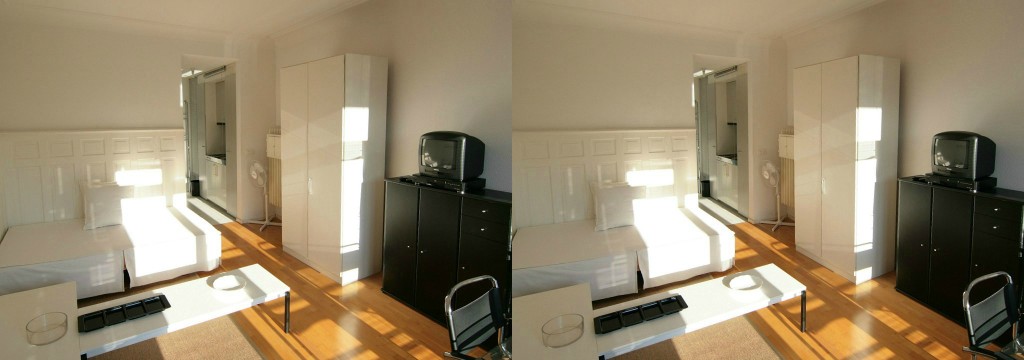
The image size is (1024, 360). Find the location of `plate`. plate is located at coordinates (743, 275), (228, 284).